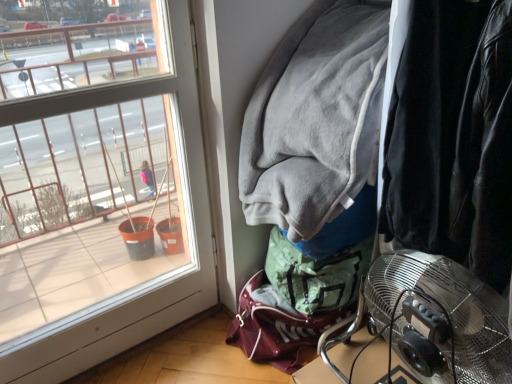
Measure the distance between velvet black jacket at right and camera.

velvet black jacket at right and camera are 27.72 inches apart.

You are a GUI agent. You are given a task and a screenshot of the screen. Output one action in this format:
    pyautogui.click(x=<x>, y=<y>)
    Task: Click on the velvet black jacket at right
    This screenshot has width=512, height=384.
    Given the screenshot: What is the action you would take?
    pyautogui.click(x=453, y=137)

Identify the location of metallic silver fan at lower right. (440, 319).

Does point (298, 113) come in front of point (484, 317)?

No, it is not.

Between gray fleece jacket at upper right and metallic silver fan at lower right, which one has less height?

Standing shorter between the two is gray fleece jacket at upper right.

Could you tell me if gray fleece jacket at upper right is turned towards metallic silver fan at lower right?

No, gray fleece jacket at upper right does not turn towards metallic silver fan at lower right.

Is clear glass window at left facing away from velvet black jacket at right?

No, clear glass window at left's orientation is not away from velvet black jacket at right.

From a real-world perspective, which is physically below, clear glass window at left or velvet black jacket at right?

From a 3D spatial view, clear glass window at left is below.

Can you confirm if clear glass window at left is taller than velvet black jacket at right?

Indeed, clear glass window at left has a greater height compared to velvet black jacket at right.

Does point (123, 312) come behind point (348, 243)?

Yes.

Is point (356, 166) positioned before point (434, 63)?

That is False.

Consider the image. How far apart are gray fleece jacket at upper right and velvet black jacket at right?

A distance of 4.66 inches exists between gray fleece jacket at upper right and velvet black jacket at right.

Considering the relative sizes of gray fleece jacket at upper right and velvet black jacket at right in the image provided, is gray fleece jacket at upper right thinner than velvet black jacket at right?

Yes.

Is gray fleece jacket at upper right at the right side of velvet black jacket at right?

Incorrect, gray fleece jacket at upper right is not on the right side of velvet black jacket at right.

In the image, is velvet black jacket at right positioned in front of or behind clear glass window at left?

Visually, velvet black jacket at right is located in front of clear glass window at left.

From the image's perspective, is velvet black jacket at right positioned above or below clear glass window at left?

velvet black jacket at right is above clear glass window at left.

Consider the image. Is velvet black jacket at right not inside clear glass window at left?

velvet black jacket at right is positioned outside clear glass window at left.

How many degrees apart are the facing directions of velvet black jacket at right and clear glass window at left?

The angle between the facing direction of velvet black jacket at right and the facing direction of clear glass window at left is 91.1 degrees.

Which object is closer to the camera taking this photo, gray fleece jacket at upper right or clear glass window at left?

clear glass window at left is in front.

Is gray fleece jacket at upper right placed right next to clear glass window at left?

No.

Does gray fleece jacket at upper right have a greater width compared to clear glass window at left?

Yes, gray fleece jacket at upper right is wider than clear glass window at left.

Considering the relative positions of gray fleece jacket at upper right and clear glass window at left in the image provided, is gray fleece jacket at upper right to the left or to the right of clear glass window at left?

From the image, it's evident that gray fleece jacket at upper right is to the right of clear glass window at left.

Is velvet black jacket at right to the right of metallic silver fan at lower right from the viewer's perspective?

Yes, velvet black jacket at right is to the right of metallic silver fan at lower right.

Considering the relative sizes of velvet black jacket at right and metallic silver fan at lower right in the image provided, is velvet black jacket at right shorter than metallic silver fan at lower right?

Incorrect, the height of velvet black jacket at right does not fall short of that of metallic silver fan at lower right.

Which of these two, velvet black jacket at right or metallic silver fan at lower right, is bigger?

With larger size is velvet black jacket at right.

In terms of width, does metallic silver fan at lower right look wider or thinner when compared to gray fleece jacket at upper right?

Clearly, metallic silver fan at lower right has less width compared to gray fleece jacket at upper right.

From the image's perspective, relative to gray fleece jacket at upper right, is metallic silver fan at lower right above or below?

metallic silver fan at lower right is below gray fleece jacket at upper right.

Is metallic silver fan at lower right turned away from gray fleece jacket at upper right?

No, metallic silver fan at lower right is not facing away from gray fleece jacket at upper right.

Can you confirm if metallic silver fan at lower right is positioned to the right of gray fleece jacket at upper right?

Indeed, metallic silver fan at lower right is positioned on the right side of gray fleece jacket at upper right.

Identify the location of mechanical fan below the gray fleece jacket at upper right (from the image's perspective). The height and width of the screenshot is (384, 512). (440, 319).

Where is `closet on the right of the clear glass window at left`? This screenshot has height=384, width=512. closet on the right of the clear glass window at left is located at coordinates (453, 137).

Which object lies nearer to the anchor point gray fleece jacket at upper right, velvet black jacket at right or metallic silver fan at lower right?

Based on the image, velvet black jacket at right appears to be nearer to gray fleece jacket at upper right.

Based on the photo, which object lies nearer to the anchor point metallic silver fan at lower right, velvet black jacket at right or clear glass window at left?

Based on the image, velvet black jacket at right appears to be nearer to metallic silver fan at lower right.

Estimate the real-world distances between objects in this image. Which object is further from clear glass window at left, velvet black jacket at right or metallic silver fan at lower right?

The object further to clear glass window at left is metallic silver fan at lower right.

Considering their positions, is clear glass window at left positioned closer to gray fleece jacket at upper right than velvet black jacket at right?

Based on the image, velvet black jacket at right appears to be nearer to gray fleece jacket at upper right.

Looking at the image, which one is located further to gray fleece jacket at upper right, clear glass window at left or metallic silver fan at lower right?

metallic silver fan at lower right is further to gray fleece jacket at upper right.

Looking at the image, which one is located further to velvet black jacket at right, clear glass window at left or gray fleece jacket at upper right?

Among the two, clear glass window at left is located further to velvet black jacket at right.

When comparing their distances from clear glass window at left, does velvet black jacket at right or gray fleece jacket at upper right seem closer?

gray fleece jacket at upper right lies closer to clear glass window at left than the other object.

When comparing their distances from velvet black jacket at right, does clear glass window at left or metallic silver fan at lower right seem closer?

Among the two, metallic silver fan at lower right is located nearer to velvet black jacket at right.

Where is `closet between gray fleece jacket at upper right and metallic silver fan at lower right in the vertical direction`? This screenshot has width=512, height=384. closet between gray fleece jacket at upper right and metallic silver fan at lower right in the vertical direction is located at coordinates (453, 137).

Locate an element on the screen. This screenshot has height=384, width=512. jacket located between clear glass window at left and velvet black jacket at right in the left-right direction is located at coordinates (315, 118).

Find the location of `mechanical fan situated between clear glass window at left and velvet black jacket at right from left to right`. mechanical fan situated between clear glass window at left and velvet black jacket at right from left to right is located at coordinates (440, 319).

This screenshot has width=512, height=384. Find the location of `jacket between clear glass window at left and metallic silver fan at lower right from left to right`. jacket between clear glass window at left and metallic silver fan at lower right from left to right is located at coordinates (315, 118).